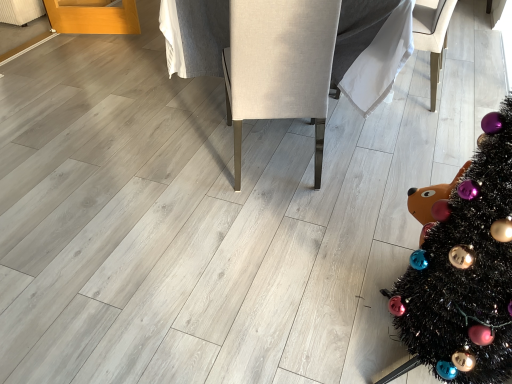
Question: Can you confirm if white fabric armchair at center, the second armchair in the left-to-right sequence, is thinner than black tinsel christmas tree at lower right?

Choices:
 (A) yes
 (B) no

Answer: (A)

Question: Does white fabric armchair at center, the second armchair in the left-to-right sequence, lie in front of black tinsel christmas tree at lower right?

Choices:
 (A) no
 (B) yes

Answer: (A)

Question: Does white fabric armchair at center, the second armchair in the left-to-right sequence, have a larger size compared to black tinsel christmas tree at lower right?

Choices:
 (A) no
 (B) yes

Answer: (A)

Question: Could you tell me if white fabric armchair at center, the second armchair in the left-to-right sequence, is turned towards black tinsel christmas tree at lower right?

Choices:
 (A) no
 (B) yes

Answer: (A)

Question: From the image's perspective, is white fabric armchair at center, placed as the 1th armchair when sorted from right to left, under black tinsel christmas tree at lower right?

Choices:
 (A) yes
 (B) no

Answer: (B)

Question: In the image, is white fabric armchair at center, placed as the 1th armchair when sorted from right to left, positioned in front of or behind black tinsel christmas tree at lower right?

Choices:
 (A) behind
 (B) front

Answer: (A)

Question: In terms of width, does white fabric armchair at center, placed as the 1th armchair when sorted from right to left, look wider or thinner when compared to black tinsel christmas tree at lower right?

Choices:
 (A) wide
 (B) thin

Answer: (B)

Question: Considering the positions of white fabric armchair at center, the second armchair in the left-to-right sequence, and black tinsel christmas tree at lower right in the image, is white fabric armchair at center, the second armchair in the left-to-right sequence, bigger or smaller than black tinsel christmas tree at lower right?

Choices:
 (A) big
 (B) small

Answer: (B)

Question: Does point (413, 26) appear closer or farther from the camera than point (507, 273)?

Choices:
 (A) farther
 (B) closer

Answer: (A)

Question: Choose the correct answer: Is white fabric armchair at center, the second armchair in the left-to-right sequence, inside beige fabric armchair at center, which is the first armchair from left to right, or outside it?

Choices:
 (A) inside
 (B) outside

Answer: (B)

Question: Considering the positions of white fabric armchair at center, the second armchair in the left-to-right sequence, and beige fabric armchair at center, the 2th armchair viewed from the right, in the image, is white fabric armchair at center, the second armchair in the left-to-right sequence, bigger or smaller than beige fabric armchair at center, the 2th armchair viewed from the right,?

Choices:
 (A) big
 (B) small

Answer: (B)

Question: From a real-world perspective, relative to beige fabric armchair at center, the 2th armchair viewed from the right, is white fabric armchair at center, placed as the 1th armchair when sorted from right to left, vertically above or below?

Choices:
 (A) above
 (B) below

Answer: (B)

Question: In terms of height, does white fabric armchair at center, the second armchair in the left-to-right sequence, look taller or shorter compared to beige fabric armchair at center, the 2th armchair viewed from the right?

Choices:
 (A) tall
 (B) short

Answer: (B)

Question: Does point (316, 33) appear closer or farther from the camera than point (420, 31)?

Choices:
 (A) closer
 (B) farther

Answer: (A)

Question: Looking at the image, does beige fabric armchair at center, which is the first armchair from left to right, seem bigger or smaller compared to white fabric armchair at center, the second armchair in the left-to-right sequence?

Choices:
 (A) big
 (B) small

Answer: (A)